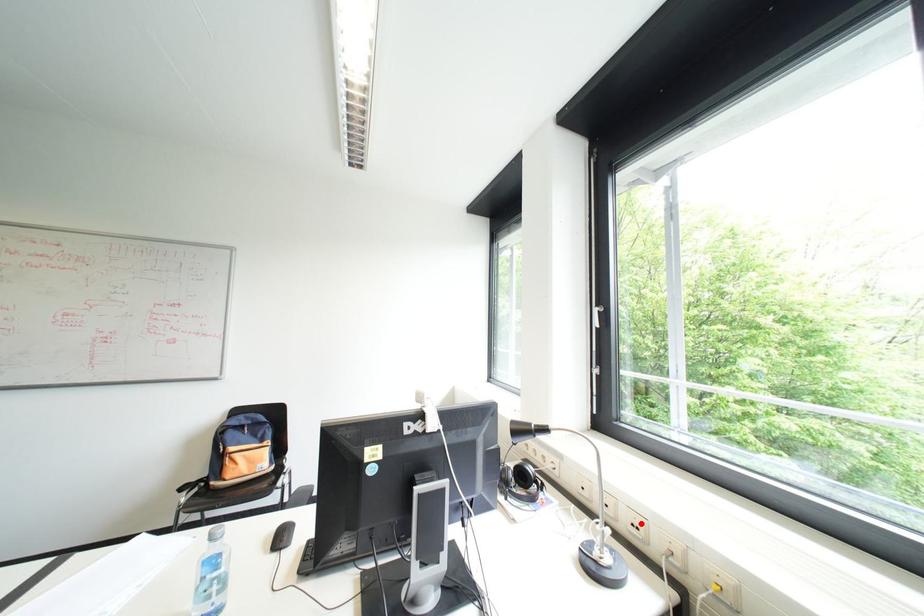
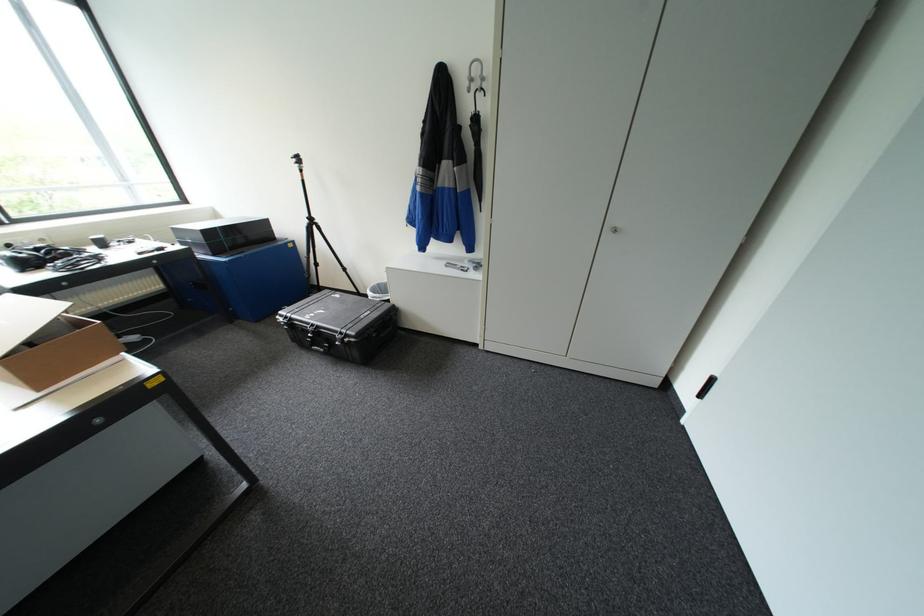
Question: I am providing you with two images of the same scene from different viewpoints. A red point is marked on the first image. At the location where the point appears in image 1, is it still visible in image 2?

Choices:
 (A) Yes
 (B) No

Answer: (B)